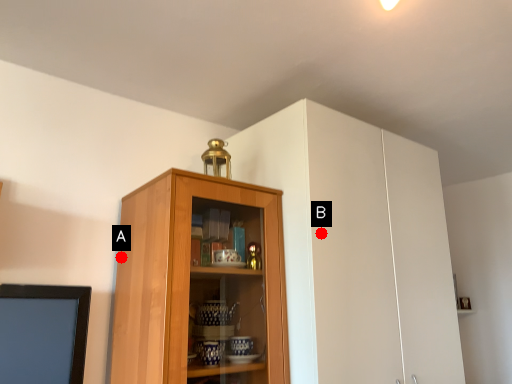
Question: Two points are circled on the image, labeled by A and B beside each circle. Which point is closer to the camera?

Choices:
 (A) A is closer
 (B) B is closer

Answer: (B)